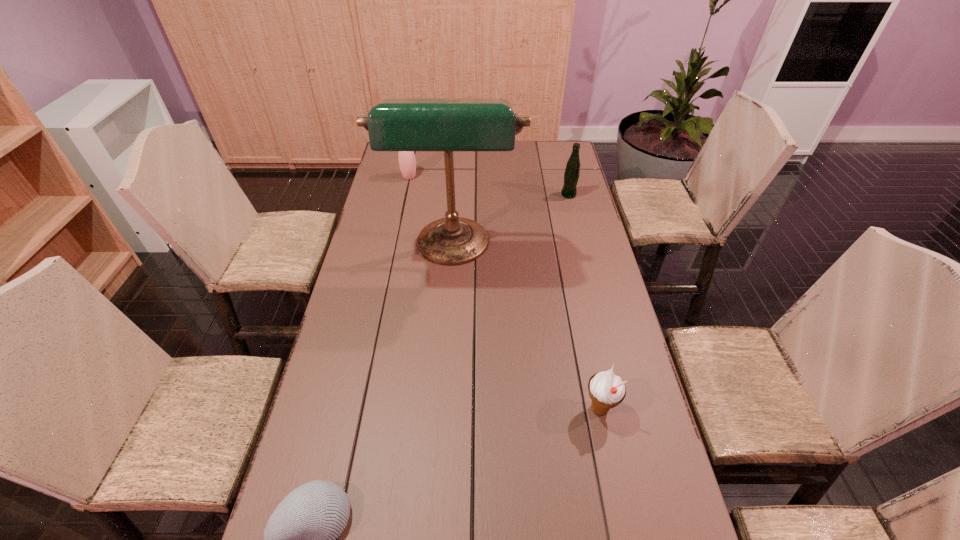
Find the location of a particular element. the third nearest object is located at coordinates (395, 124).

This screenshot has height=540, width=960. I want to click on table lamp, so click(x=395, y=124).

This screenshot has height=540, width=960. Find the location of `the second farthest object`. the second farthest object is located at coordinates (572, 171).

The width and height of the screenshot is (960, 540). I want to click on the farthest object, so click(x=407, y=162).

Where is `icecream`? icecream is located at coordinates (606, 390).

At what (x,y) coordinates should I click in order to perform the action: click on the second shortest object. Please return your answer as a coordinate pair (x, y). This screenshot has width=960, height=540. Looking at the image, I should click on (606, 390).

I want to click on vacant space situated 0.100m above the green lampshade of the tallest object, so click(449, 307).

Where is `vacant space located 0.270m on the left of the fourth nearest object`? vacant space located 0.270m on the left of the fourth nearest object is located at coordinates (494, 194).

Locate an element on the screen. This screenshot has height=540, width=960. free region located on the front of the thermos bottle is located at coordinates (402, 208).

The height and width of the screenshot is (540, 960). I want to click on free location located on the left of the fourth tallest object, so click(x=518, y=409).